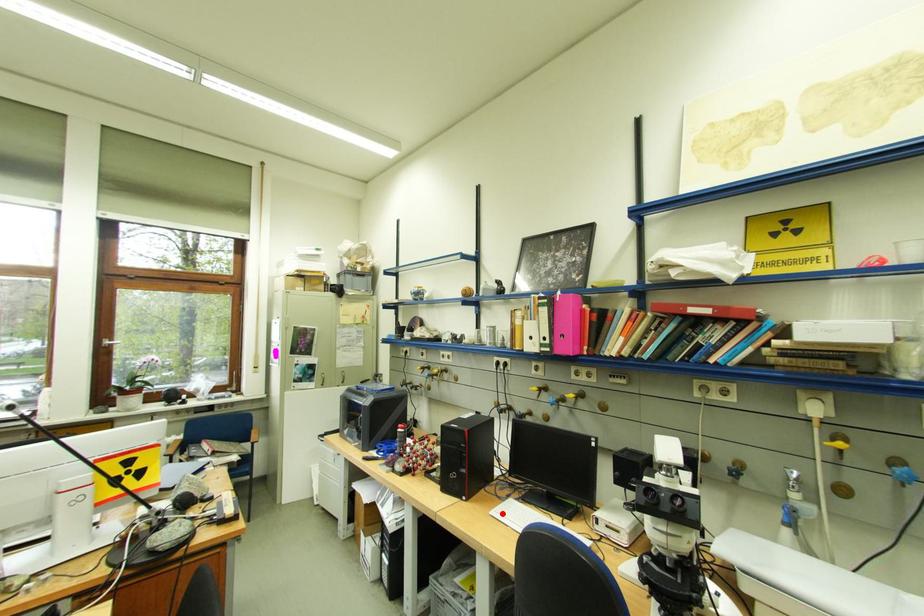
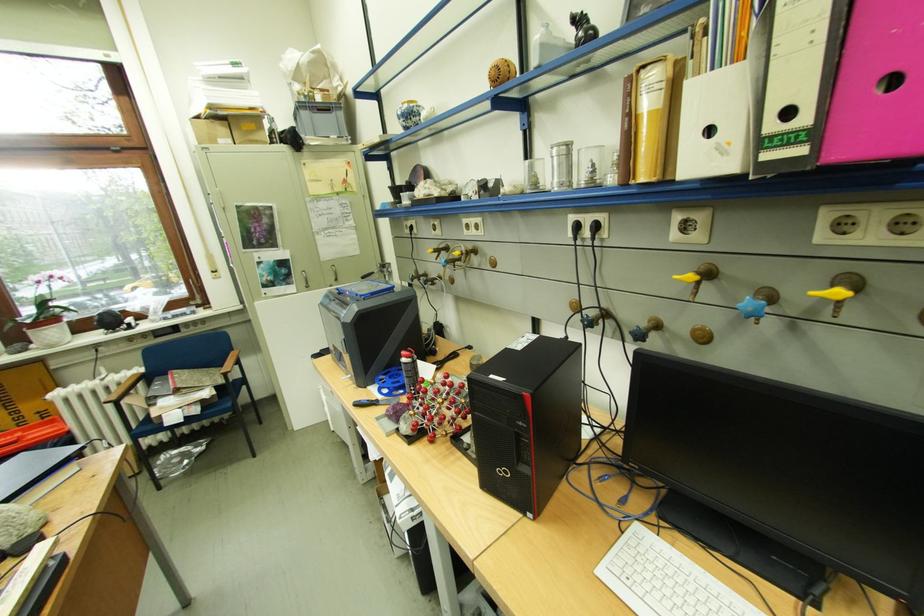
Where in the second image is the point corresponding to the highlighted location from the first image?

(612, 573)